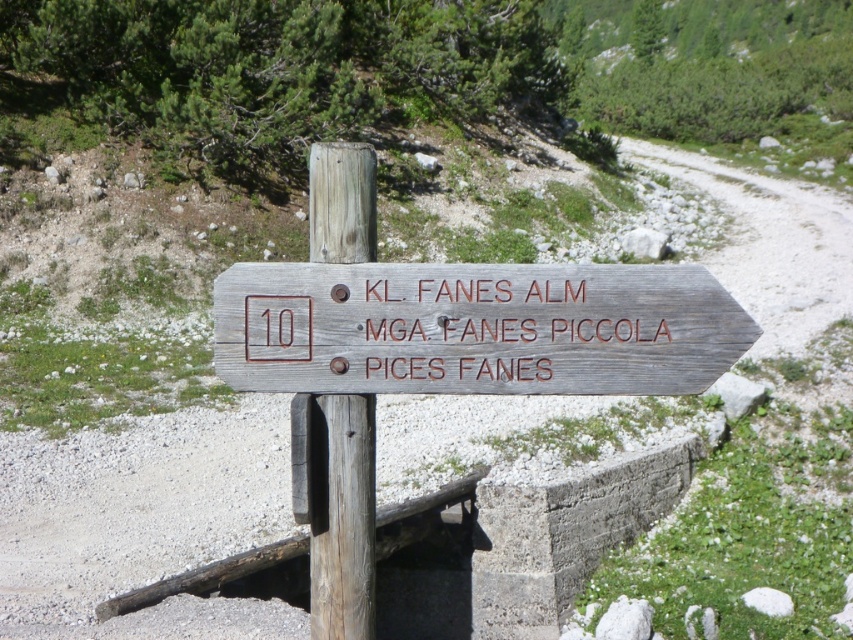
Based on the photo, who is positioned more to the right, weathered wood sign at center or weathered wood signpost at center?

Positioned to the right is weathered wood sign at center.

Is point (432, 307) more distant than point (349, 524)?

That is False.

Image resolution: width=853 pixels, height=640 pixels. What are the coordinates of `weathered wood sign at center` in the screenshot? It's located at (474, 328).